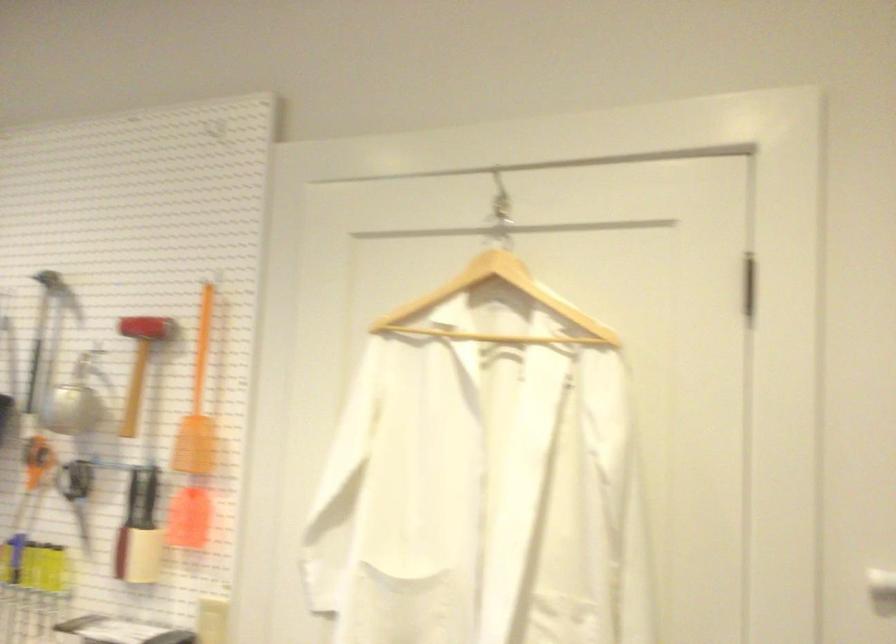
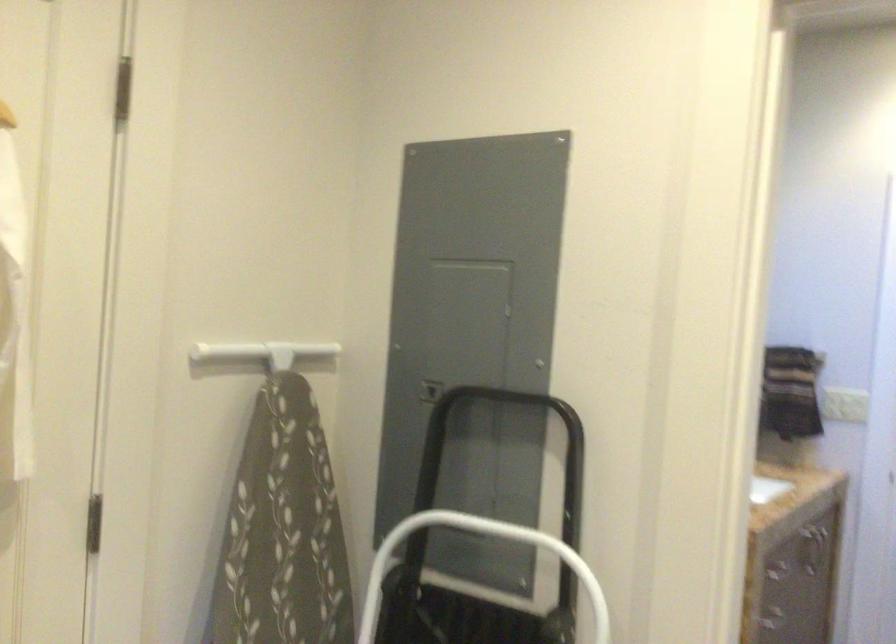
Question: The camera is either moving clockwise (left) or counter-clockwise (right) around the object. The first image is from the beginning of the video and the second image is from the end. Is the camera moving left or right when shooting the video?

Choices:
 (A) Left
 (B) Right

Answer: (A)